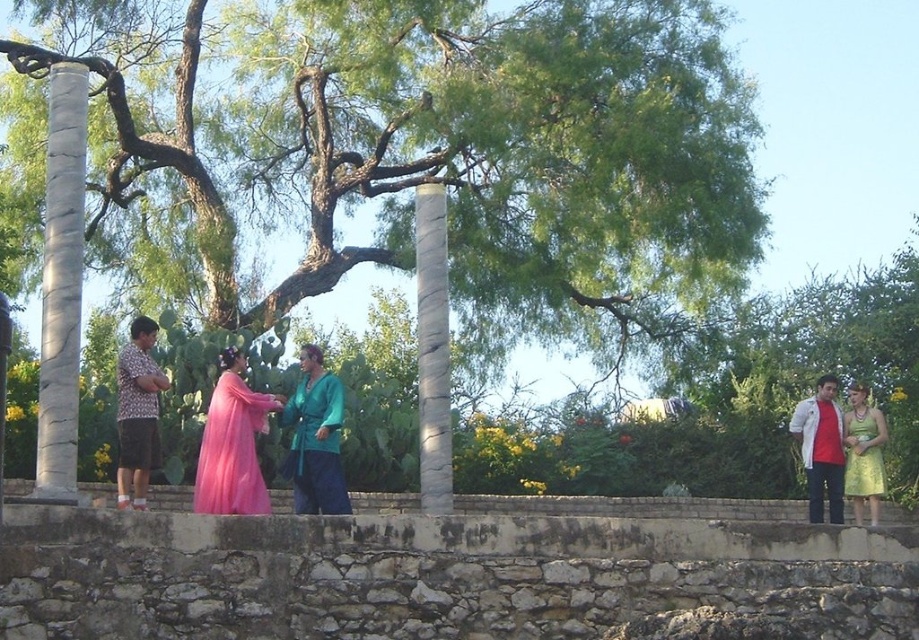
You are planning to place a new bench in the garden. The bench requires a space wider than the marble column at center. Can the space occupied by the green leafy tree at center accommodate the bench?

The green leafy tree at center has a width that surpasses the marble column at center. Since the bench requires a space wider than the marble column at center, the space occupied by the green leafy tree at center can accommodate the bench.

You are standing in the garden and want to take a photo of the green leafy tree at center and the marble column at center. If you want the tree to appear to the left of the column in your photo, should you position yourself to the left or right of the scene?

You should position yourself to the right of the scene so that the green leafy tree at center appears to the left of the marble column at center in your photo.

You are standing at the center of the garden and want to locate the marble column at left. According to the coordinates provided, where would you find it relative to your position?

The marble column at left is located at coordinates point 0.444 on the x axis and 0.067 on the y axis, which would place it to the left and slightly forward from your central position in the garden.